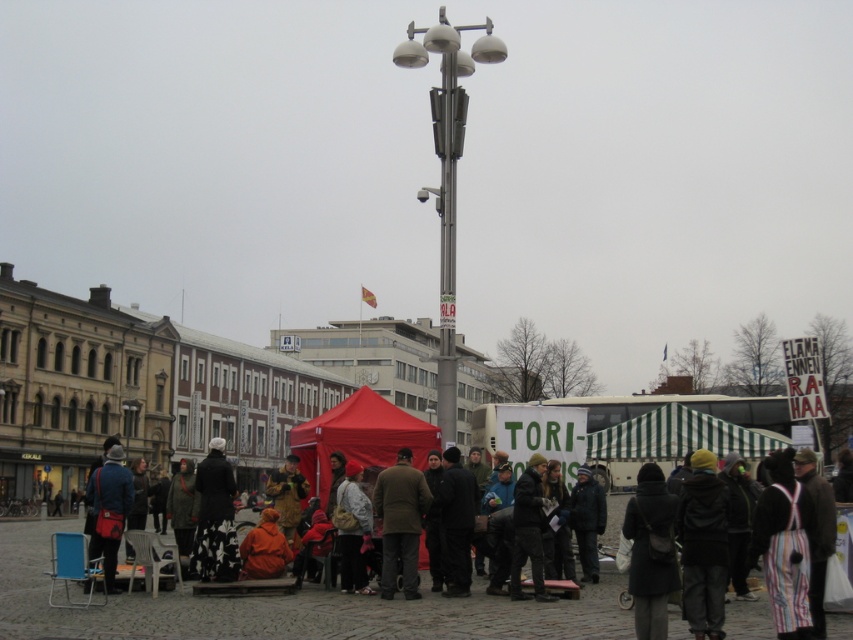
Is dark gray wool coat at lower center shorter than orange fabric jacket at lower center?

No, dark gray wool coat at lower center is not shorter than orange fabric jacket at lower center.

Can you confirm if dark gray wool coat at lower center is wider than orange fabric jacket at lower center?

In fact, dark gray wool coat at lower center might be narrower than orange fabric jacket at lower center.

At what (x,y) coordinates should I click in order to perform the action: click on dark gray wool coat at lower center. Please return your answer as a coordinate pair (x, y). Looking at the image, I should click on (651, 552).

Can you confirm if dark gray clothing at center is smaller than dark gray wool coat at lower center?

No.

Is dark gray clothing at center above dark gray wool coat at lower center?

No.

Between point (744, 628) and point (648, 580), which one is positioned in front?

Point (648, 580) is more forward.

This screenshot has width=853, height=640. Identify the location of dark gray clothing at center. (347, 616).

Does orange fabric tent at center have a lesser height compared to orange fabric jacket at lower center?

In fact, orange fabric tent at center may be taller than orange fabric jacket at lower center.

Does orange fabric tent at center lie behind orange fabric jacket at lower center?

No, it is not.

Does point (363, 577) come farther from viewer compared to point (264, 509)?

No, (363, 577) is in front of (264, 509).

Where is `orange fabric tent at center`? orange fabric tent at center is located at coordinates (352, 529).